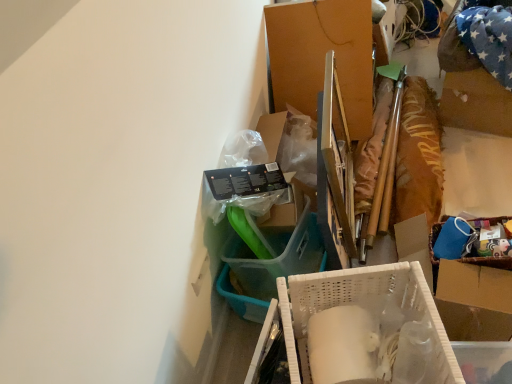
This screenshot has height=384, width=512. What do you see at coordinates (362, 307) in the screenshot?
I see `white plastic basket at center, placed as the 2th box when sorted from top to bottom` at bounding box center [362, 307].

You are a GUI agent. You are given a task and a screenshot of the screen. Output one action in this format:
    pyautogui.click(x=<x>, y=<y>)
    Task: Click on the cardboard box at center, acting as the 1th box starting from the back
    The image size is (512, 384).
    Given the screenshot: What is the action you would take?
    pyautogui.click(x=322, y=57)

Describe the element at coordinates (476, 164) in the screenshot. I see `white plastic basket at center` at that location.

The height and width of the screenshot is (384, 512). Find the location of `white plastic basket at center, marked as the first box in a front-to-back arrangement`. white plastic basket at center, marked as the first box in a front-to-back arrangement is located at coordinates (362, 307).

From the picture: From the image's perspective, which is above, white plastic basket at center or white plastic basket at center, the second box positioned from the back?

white plastic basket at center.

Who is bigger, white plastic basket at center or white plastic basket at center, placed as the 2th box when sorted from top to bottom?

white plastic basket at center is bigger.

Is white plastic basket at center oriented away from white plastic basket at center, which appears as the 1th box when ordered from the bottom?

That's right, white plastic basket at center is facing away from white plastic basket at center, which appears as the 1th box when ordered from the bottom.

Is white plastic basket at center to the left of cardboard box at center, acting as the 2th box starting from the front, from the viewer's perspective?

Yes.

Between white plastic basket at center and cardboard box at center, positioned as the 1th box in top-to-bottom order, which one has larger width?

cardboard box at center, positioned as the 1th box in top-to-bottom order, is wider.

Is white plastic basket at center spatially inside cardboard box at center, acting as the 1th box starting from the back, or outside of it?

white plastic basket at center is not inside cardboard box at center, acting as the 1th box starting from the back, it's outside.

Looking at this image, is white plastic basket at center with cardboard box at center, acting as the 2th box starting from the front?

white plastic basket at center and cardboard box at center, acting as the 2th box starting from the front, are clearly separated.

The image size is (512, 384). I want to click on box lying below the cardboard box at center, positioned as the 1th box in top-to-bottom order (from the image's perspective), so click(x=362, y=307).

Is point (302, 77) closer or farther from the camera than point (297, 381)?

Clearly, point (302, 77) is more distant from the camera than point (297, 381).

Looking at this image, is cardboard box at center, acting as the 1th box starting from the back, spatially inside white plastic basket at center, placed as the 2th box when sorted from top to bottom, or outside of it?

cardboard box at center, acting as the 1th box starting from the back, exists outside the volume of white plastic basket at center, placed as the 2th box when sorted from top to bottom.

Between cardboard box at center, acting as the second box starting from the bottom, and white plastic basket at center, the second box positioned from the back, which one has less height?

white plastic basket at center, the second box positioned from the back, is shorter.

Considering the sizes of objects white plastic basket at center, the second box positioned from the back, and cardboard box at center, acting as the 2th box starting from the front, in the image provided, who is taller, white plastic basket at center, the second box positioned from the back, or cardboard box at center, acting as the 2th box starting from the front,?

cardboard box at center, acting as the 2th box starting from the front, is taller.

Is white plastic basket at center, placed as the 2th box when sorted from top to bottom, next to cardboard box at center, positioned as the 1th box in top-to-bottom order, and touching it?

No, white plastic basket at center, placed as the 2th box when sorted from top to bottom, is not with cardboard box at center, positioned as the 1th box in top-to-bottom order.

Which is in front, white plastic basket at center, which appears as the 1th box when ordered from the bottom, or white plastic basket at center?

white plastic basket at center is closer to the camera.

From a real-world perspective, is white plastic basket at center, the second box positioned from the back, positioned over white plastic basket at center based on gravity?

No, from a real-world perspective, white plastic basket at center, the second box positioned from the back, is not on top of white plastic basket at center.

Is white plastic basket at center, placed as the 2th box when sorted from top to bottom, facing towards white plastic basket at center?

Yes, white plastic basket at center, placed as the 2th box when sorted from top to bottom, faces towards white plastic basket at center.

Considering the positions of points (297, 359) and (430, 75), is point (297, 359) farther from camera compared to point (430, 75)?

No, (297, 359) is closer to viewer.

Does point (351, 87) lie behind point (492, 144)?

No, it is in front of (492, 144).

Choose the correct answer: Is cardboard box at center, positioned as the 1th box in top-to-bottom order, inside white plastic basket at center or outside it?

cardboard box at center, positioned as the 1th box in top-to-bottom order, is spatially situated outside white plastic basket at center.

Are cardboard box at center, positioned as the 1th box in top-to-bottom order, and white plastic basket at center located far from each other?

cardboard box at center, positioned as the 1th box in top-to-bottom order, is near white plastic basket at center, not far away.

How far apart are cardboard box at center, acting as the second box starting from the bottom, and white plastic basket at center?

cardboard box at center, acting as the second box starting from the bottom, and white plastic basket at center are 25.07 inches apart from each other.

From the white plastic basket at center, count 1st boxs backward and point to it. Please provide its 2D coordinates.

[(362, 307)]

At what (x,y) coordinates should I click in order to perform the action: click on collection that appears above the cardboard box at center, acting as the 2th box starting from the front (from a real-world perspective). Please return your answer as a coordinate pair (x, y). Looking at the image, I should click on [476, 164].

Considering their positions, is cardboard box at center, acting as the 1th box starting from the back, positioned further to white plastic basket at center than white plastic basket at center, marked as the first box in a front-to-back arrangement?

white plastic basket at center, marked as the first box in a front-to-back arrangement, is positioned further to the anchor white plastic basket at center.

Looking at the image, which one is located closer to cardboard box at center, acting as the second box starting from the bottom, white plastic basket at center, placed as the 2th box when sorted from top to bottom, or white plastic basket at center?

Among the two, white plastic basket at center is located nearer to cardboard box at center, acting as the second box starting from the bottom.

Based on their spatial positions, is white plastic basket at center or cardboard box at center, acting as the 2th box starting from the front, closer to white plastic basket at center, marked as the first box in a front-to-back arrangement?

white plastic basket at center is positioned closer to the anchor white plastic basket at center, marked as the first box in a front-to-back arrangement.

From the image, which object appears to be nearer to white plastic basket at center, white plastic basket at center, which appears as the 1th box when ordered from the bottom, or cardboard box at center, positioned as the 1th box in top-to-bottom order?

cardboard box at center, positioned as the 1th box in top-to-bottom order, lies closer to white plastic basket at center than the other object.

Based on their spatial positions, is white plastic basket at center or white plastic basket at center, the second box positioned from the back, further from cardboard box at center, acting as the 1th box starting from the back?

Based on the image, white plastic basket at center, the second box positioned from the back, appears to be further to cardboard box at center, acting as the 1th box starting from the back.

Considering their positions, is cardboard box at center, acting as the second box starting from the bottom, positioned closer to white plastic basket at center, marked as the first box in a front-to-back arrangement, than white plastic basket at center?

white plastic basket at center.

At what (x,y) coordinates should I click in order to perform the action: click on box between white plastic basket at center and cardboard box at center, acting as the 2th box starting from the front, along the z-axis. Please return your answer as a coordinate pair (x, y). This screenshot has height=384, width=512. Looking at the image, I should click on (362, 307).